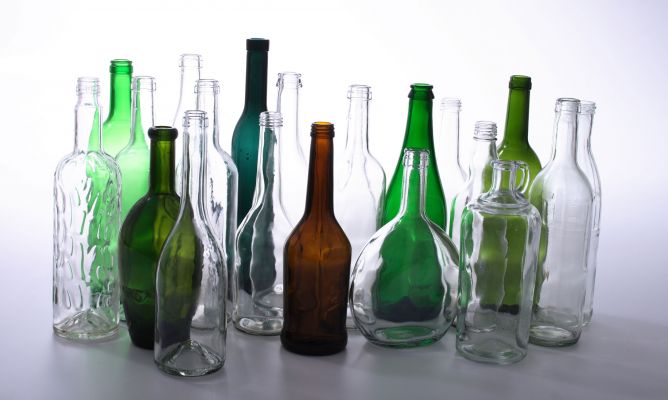
Where is `bottles to the right of the brown bottle`? This screenshot has height=400, width=668. bottles to the right of the brown bottle is located at coordinates (355, 190), (403, 251), (415, 129), (448, 141), (480, 149), (508, 236), (514, 129), (562, 189), (582, 160).